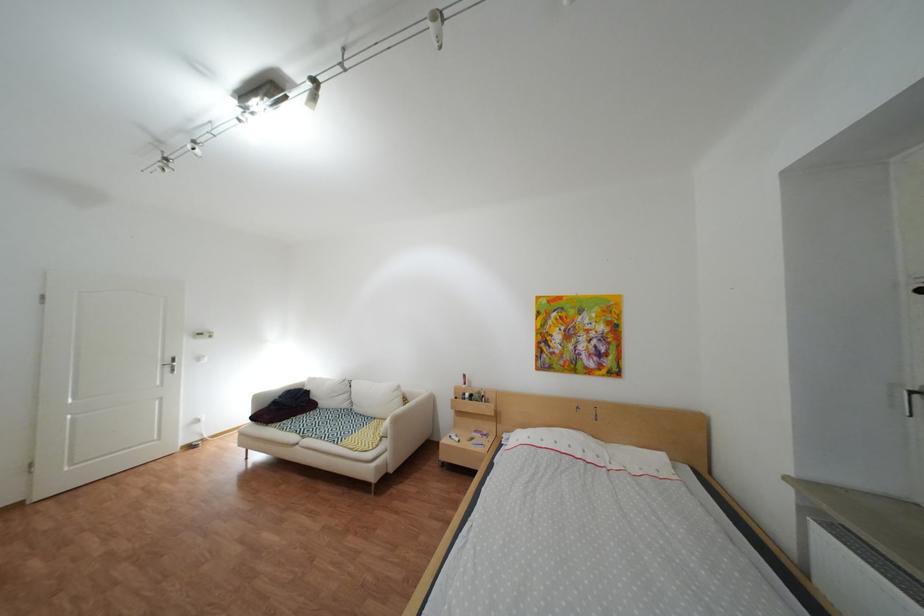
Describe the element at coordinates (169, 363) in the screenshot. I see `the silver door handle` at that location.